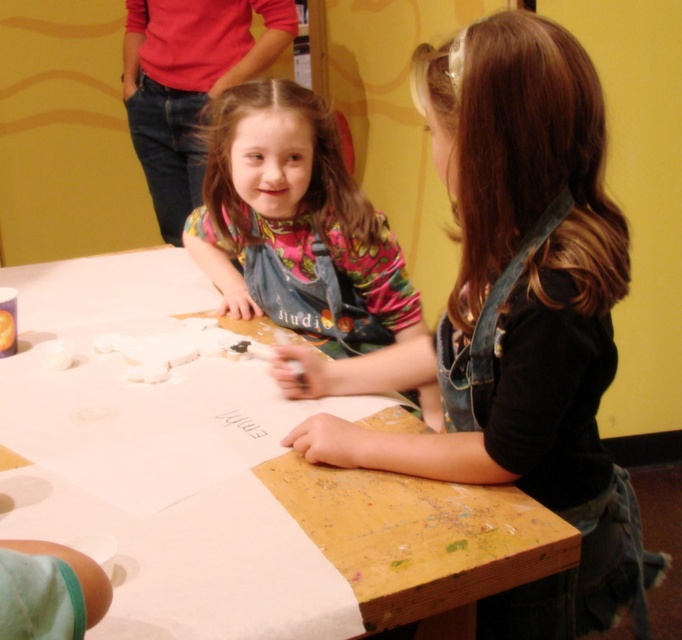
From the picture: You are a photographer trying to capture a clear shot of both the denim overalls at center and the matte denim apron at center. Since they are both at the center, will you need to adjust your camera angle to focus on both?

The denim overalls at center is in front of the matte denim apron at center, so you will need to adjust your camera angle to focus on both to avoid the denim overalls at center blocking the view of the matte denim apron at center.

You are a photographer setting up for a group photo of the two girls at the table. You need to ensure the white paper at center and the matte denim apron at center are both clearly visible in the shot. Based on their positions, which object should you prioritize framing closer to the left side of the photo?

The white paper at center should be prioritized closer to the left side of the photo since it is positioned on the left side of the matte denim apron at center.